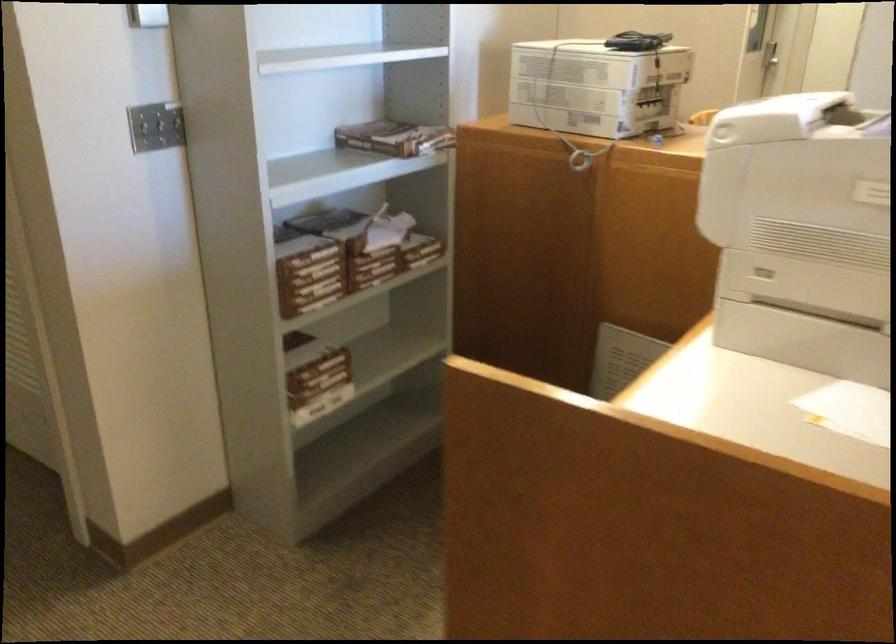
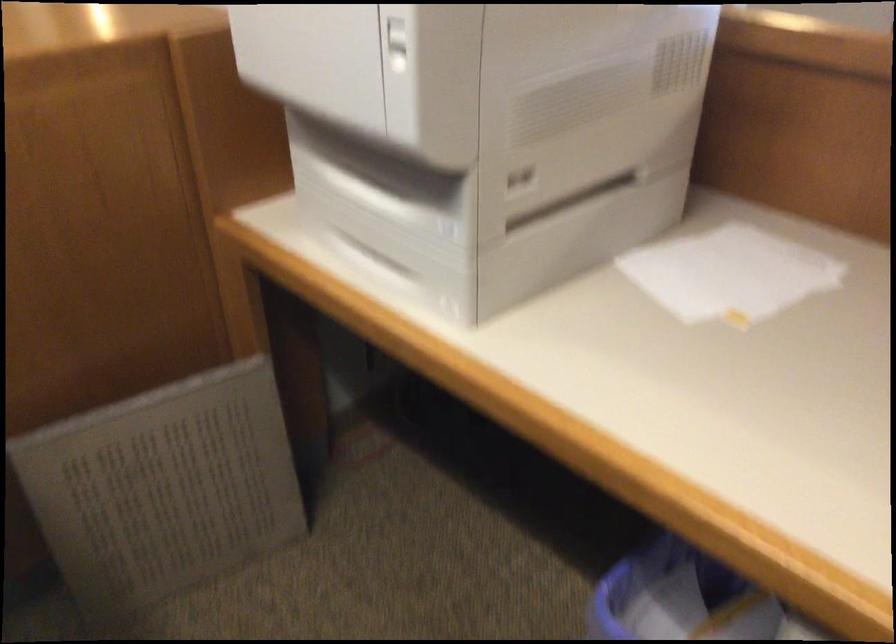
In the second image, find the point that corresponds to pixel 741 279 in the first image.

(391, 220)